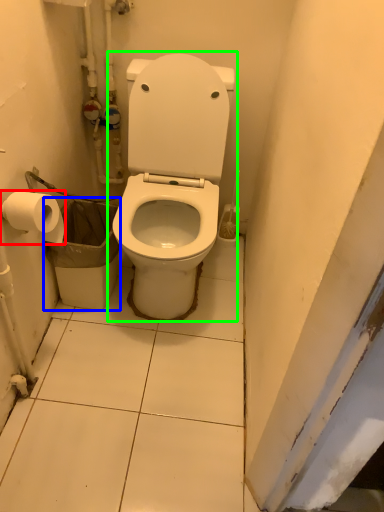
Question: Considering the real-world distances, which object is closest to toilet paper (highlighted by a red box)? garbage (highlighted by a blue box) or toilet (highlighted by a green box).

Choices:
 (A) garbage
 (B) toilet

Answer: (A)